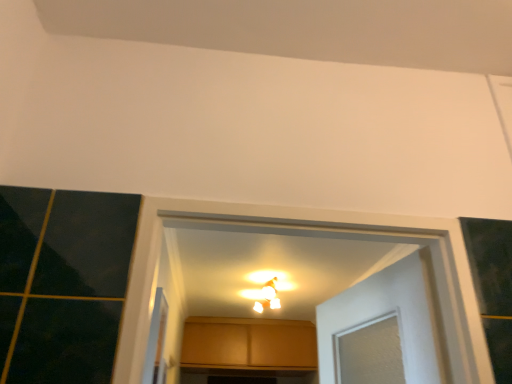
The width and height of the screenshot is (512, 384). Identify the location of matte wood cabinet at center. (248, 344).

Describe the element at coordinates (248, 344) in the screenshot. I see `matte wood cabinet at center` at that location.

At what (x,y) coordinates should I click in order to perform the action: click on clear plastic screen door at lower left. Please return your answer as a coordinate pair (x, y). This screenshot has width=512, height=384. Looking at the image, I should click on (156, 342).

In the image, is clear plastic screen door at lower left on the left side or the right side of matte wood cabinet at center?

From the image, it's evident that clear plastic screen door at lower left is to the left of matte wood cabinet at center.

Would you say matte wood cabinet at center is part of clear plastic screen door at lower left's contents?

No, matte wood cabinet at center is not surrounded by clear plastic screen door at lower left.

From a real-world perspective, is clear plastic screen door at lower left above or below matte wood cabinet at center?

In terms of real-world spatial position, clear plastic screen door at lower left is below matte wood cabinet at center.

Is clear plastic screen door at lower left touching matte wood cabinet at center?

No, clear plastic screen door at lower left is not making contact with matte wood cabinet at center.

From the image's perspective, relative to matte white light fixture at center, is clear plastic screen door at lower left above or below?

Based on their image positions, clear plastic screen door at lower left is located above matte white light fixture at center.

Which is more to the left, clear plastic screen door at lower left or matte white light fixture at center?

clear plastic screen door at lower left.

From a real-world perspective, which object stands above the other?

matte white light fixture at center.

Considering the sizes of objects clear plastic screen door at lower left and matte white light fixture at center in the image provided, who is shorter, clear plastic screen door at lower left or matte white light fixture at center?

With less height is matte white light fixture at center.

Would you say matte white light fixture at center contains matte wood cabinet at center?

No, matte white light fixture at center does not contain matte wood cabinet at center.

Can you confirm if matte white light fixture at center is positioned to the left of matte wood cabinet at center?

No, matte white light fixture at center is not to the left of matte wood cabinet at center.

Considering the relative sizes of matte white light fixture at center and matte wood cabinet at center in the image provided, is matte white light fixture at center thinner than matte wood cabinet at center?

Yes.

Is matte white light fixture at center not near matte wood cabinet at center?

No, matte white light fixture at center is not far away from matte wood cabinet at center.

Between matte wood cabinet at center and matte white light fixture at center, which one is positioned in front?

matte white light fixture at center.

Considering the positions of objects matte wood cabinet at center and matte white light fixture at center in the image provided, who is more to the right, matte wood cabinet at center or matte white light fixture at center?

Positioned to the right is matte white light fixture at center.

Are matte wood cabinet at center and matte white light fixture at center located far from each other?

No, there isn't a large distance between matte wood cabinet at center and matte white light fixture at center.

Does matte wood cabinet at center contain matte white light fixture at center?

No, matte white light fixture at center is not inside matte wood cabinet at center.

Looking at this image, from the image's perspective, is matte wood cabinet at center on top of clear plastic screen door at lower left?

No, from the image's perspective, matte wood cabinet at center is not above clear plastic screen door at lower left.

Are matte wood cabinet at center and clear plastic screen door at lower left making contact?

No, matte wood cabinet at center is not making contact with clear plastic screen door at lower left.

Which is in front, matte wood cabinet at center or clear plastic screen door at lower left?

clear plastic screen door at lower left.

Where is `screen door that appears on the left of matte white light fixture at center`? Image resolution: width=512 pixels, height=384 pixels. screen door that appears on the left of matte white light fixture at center is located at coordinates (156, 342).

From the image's perspective, is matte white light fixture at center located above or below clear plastic screen door at lower left?

matte white light fixture at center is situated lower than clear plastic screen door at lower left in the image.

From a real-world perspective, is matte white light fixture at center physically located above or below clear plastic screen door at lower left?

matte white light fixture at center is situated higher than clear plastic screen door at lower left in the real world.

What's the angular difference between matte white light fixture at center and clear plastic screen door at lower left's facing directions?

180 degrees.

Identify the location of cabinetry below the clear plastic screen door at lower left (from the image's perspective). This screenshot has height=384, width=512. (248, 344).

In order to click on screen door to the left of matte white light fixture at center in this screenshot , I will do point(156,342).

Considering their positions, is clear plastic screen door at lower left positioned closer to matte wood cabinet at center than matte white light fixture at center?

matte white light fixture at center is closer to matte wood cabinet at center.

Looking at the image, which one is located closer to matte white light fixture at center, matte wood cabinet at center or clear plastic screen door at lower left?

matte wood cabinet at center is positioned closer to the anchor matte white light fixture at center.

Considering their positions, is matte wood cabinet at center positioned closer to clear plastic screen door at lower left than matte white light fixture at center?

matte white light fixture at center.

From the picture: Estimate the real-world distances between objects in this image. Which object is closer to matte wood cabinet at center, matte white light fixture at center or clear plastic screen door at lower left?

Based on the image, matte white light fixture at center appears to be nearer to matte wood cabinet at center.

Estimate the real-world distances between objects in this image. Which object is closer to clear plastic screen door at lower left, matte white light fixture at center or matte wood cabinet at center?

matte white light fixture at center is closer to clear plastic screen door at lower left.

Considering their positions, is clear plastic screen door at lower left positioned further to matte white light fixture at center than matte wood cabinet at center?

The object further to matte white light fixture at center is clear plastic screen door at lower left.

Find the location of a particular element. The width and height of the screenshot is (512, 384). light fixture positioned between clear plastic screen door at lower left and matte wood cabinet at center from near to far is located at coordinates (268, 296).